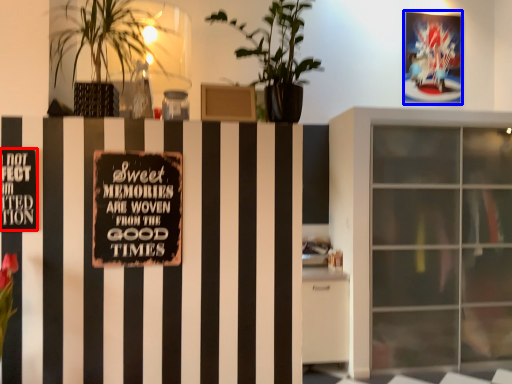
Question: Which object is closer to the camera taking this photo, warning sign (highlighted by a red box) or postcard (highlighted by a blue box)?

Choices:
 (A) warning sign
 (B) postcard

Answer: (A)